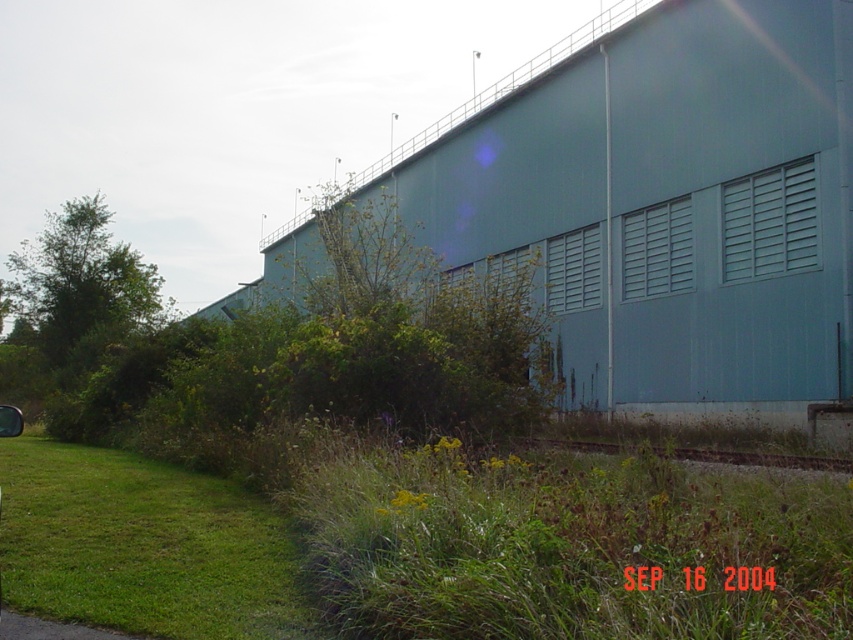
Does green grassy at lower left have a larger size compared to gray gravel train track at lower center?

Incorrect, green grassy at lower left is not larger than gray gravel train track at lower center.

Which of these two, green grassy at lower left or gray gravel train track at lower center, stands taller?

gray gravel train track at lower center

Does point (170, 624) lie in front of point (764, 461)?

That is True.

What are the coordinates of `green grassy at lower left` in the screenshot? It's located at (143, 547).

Is green grassy at lower left to the right of metallic silver car at lower left from the viewer's perspective?

In fact, green grassy at lower left is to the left of metallic silver car at lower left.

Locate an element on the screen. The image size is (853, 640). green grassy at lower left is located at coordinates (143, 547).

Is gray gravel train track at lower center to the right of metallic silver car at lower left from the viewer's perspective?

Correct, you'll find gray gravel train track at lower center to the right of metallic silver car at lower left.

Does gray gravel train track at lower center appear on the left side of metallic silver car at lower left?

No, gray gravel train track at lower center is not to the left of metallic silver car at lower left.

Which is behind, point (579, 444) or point (9, 429)?

The point (579, 444) is more distant.

The height and width of the screenshot is (640, 853). In order to click on gray gravel train track at lower center in this screenshot , I will do `click(757, 458)`.